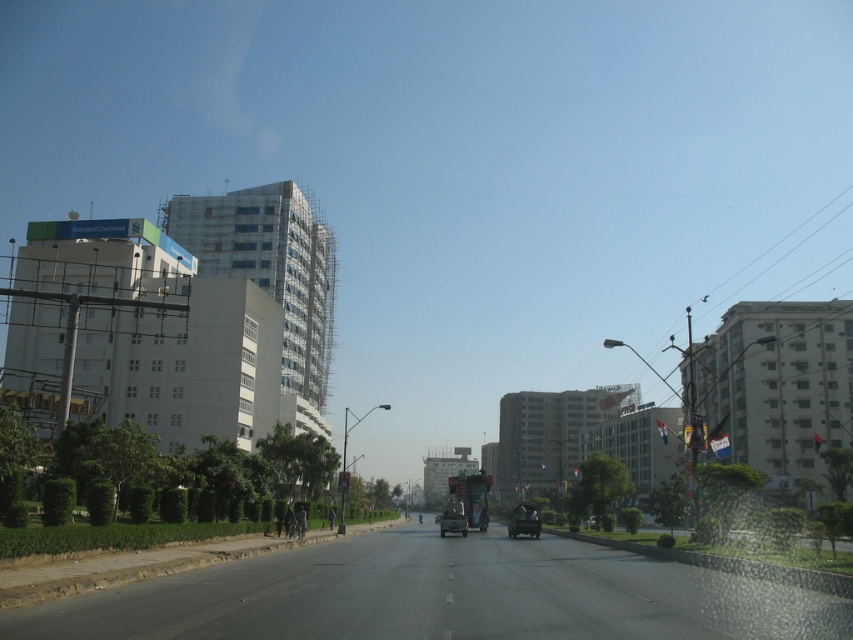
You are a delivery driver needing to park your 2.5 meter wide truck in this urban street. There is a metallic silver car at center and a metallic silver truck at center. Can you safely park your truck between them without overlapping?

The metallic silver car at center is 6.47 meters from the metallic silver truck at center. Since your truck is 2.5 meters wide, there is enough space between them to park safely without overlapping.

You are a pedestrian standing at the crosswalk and see a metallic silver car at center and a metallic silver truck at center. Which one is more to the right?

The metallic silver car at center is more to the right than the metallic silver truck at center.

You are a pedestrian standing on the sidewalk. You see a metallic silver car at center and a metallic silver truck at center. Which vehicle is closer to the ground?

The metallic silver car at center is closer to the ground because it is below the metallic silver truck at center.